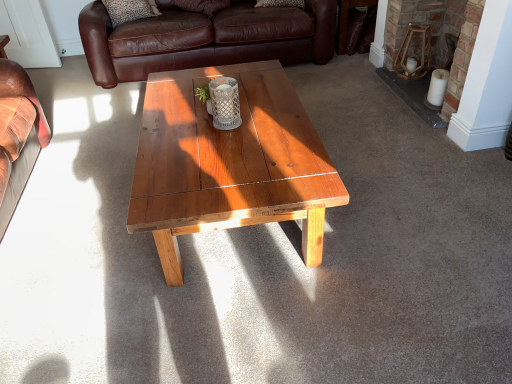
Question: Is point tap(398, 76) positioned closer to the camera than point tap(437, 61)?

Choices:
 (A) farther
 (B) closer

Answer: (B)

Question: From a real-world perspective, relative to brick fireplace at right, is wooden stool at upper right vertically above or below?

Choices:
 (A) above
 (B) below

Answer: (B)

Question: Considering the real-world distances, which object is closest to the wooden stool at upper right?

Choices:
 (A) brick fireplace at right
 (B) brown leather side table at upper right
 (C) brown leather couch at upper center
 (D) leopard print fabric pillow at upper left

Answer: (A)

Question: Which of these objects is positioned farthest from the wooden stool at upper right?

Choices:
 (A) leopard print fabric pillow at upper left
 (B) brown leather couch at upper center
 (C) brown leather side table at upper right
 (D) brick fireplace at right

Answer: (A)